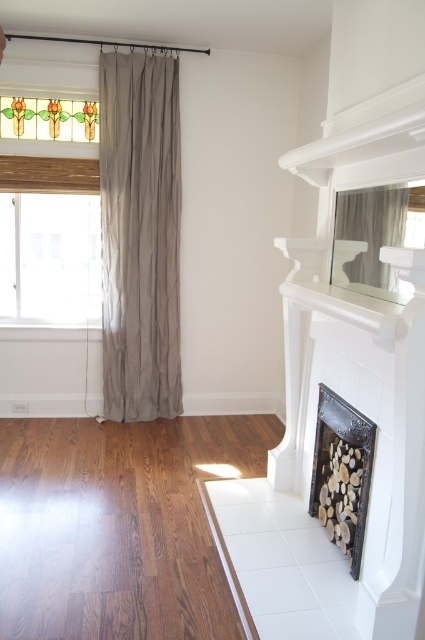
Question: Which of these objects is positioned farthest from the clear glass window at left?

Choices:
 (A) dark brown wood flooring at lower left
 (B) black textured tile fireplace at center-right
 (C) neutral linen curtain at left

Answer: (B)

Question: Which object is closer to the camera taking this photo?

Choices:
 (A) stained glass window at upper left
 (B) dark brown wood flooring at lower left
 (C) clear glass window at left

Answer: (B)

Question: Does dark brown wood flooring at lower left lie behind black textured tile fireplace at center-right?

Choices:
 (A) no
 (B) yes

Answer: (A)

Question: Can you confirm if dark brown wood flooring at lower left is smaller than black textured tile fireplace at center-right?

Choices:
 (A) yes
 (B) no

Answer: (B)

Question: Which point is closer to the camera?

Choices:
 (A) tap(141, 380)
 (B) tap(76, 106)
 (C) tap(342, 484)

Answer: (C)

Question: Is neutral linen curtain at left below clear glass window at left?

Choices:
 (A) yes
 (B) no

Answer: (B)